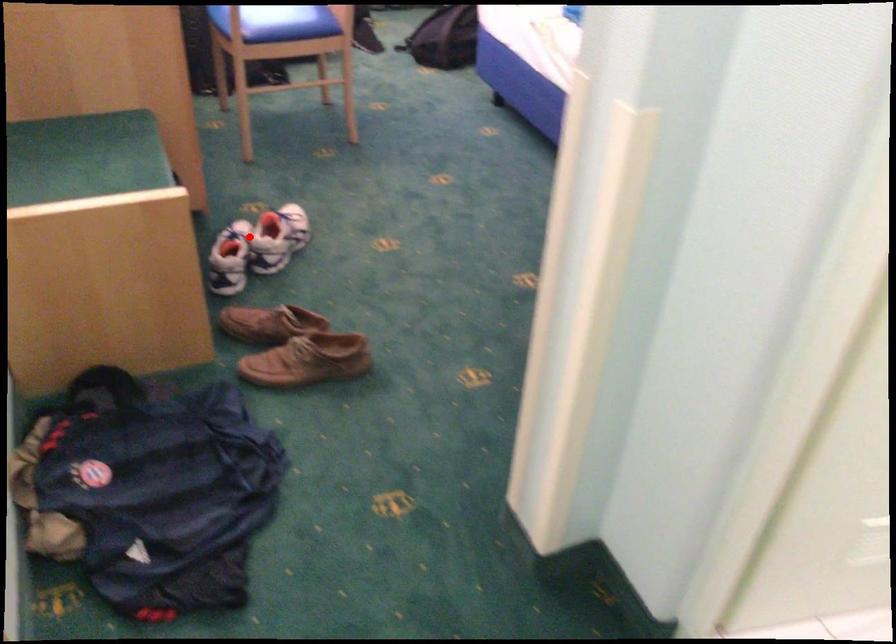
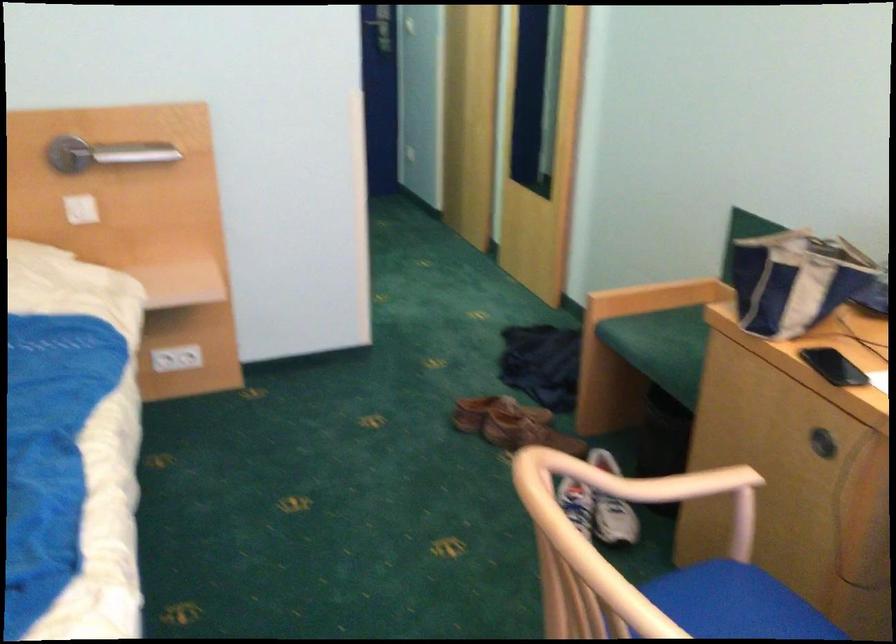
In the second image, find the point that corresponds to the highlighted location in the first image.

(609, 542)